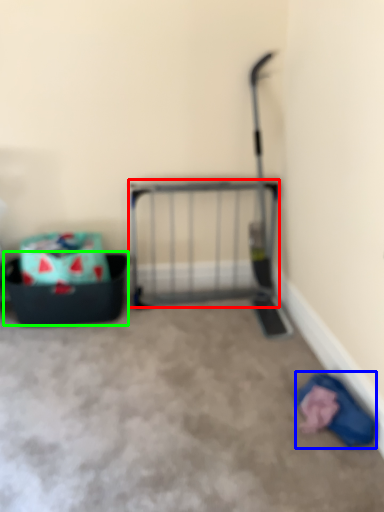
Question: Which object is positioned farthest from cage (highlighted by a red box)? Select from clothing (highlighted by a blue box) and storage box (highlighted by a green box).

Choices:
 (A) clothing
 (B) storage box

Answer: (A)